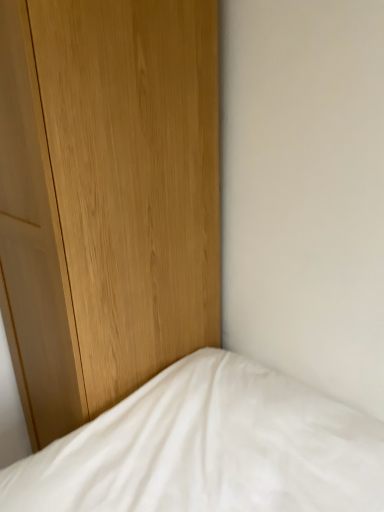
You are a GUI agent. You are given a task and a screenshot of the screen. Output one action in this format:
    pyautogui.click(x=<x>, y=<y>)
    Task: Click on the white matte bed at lower right
    
    Given the screenshot: What is the action you would take?
    pyautogui.click(x=209, y=448)

Consider the image. Measure the distance between point (268, 505) and camera.

A distance of 38.58 inches exists between point (268, 505) and camera.

The image size is (384, 512). Describe the element at coordinates (209, 448) in the screenshot. I see `white matte bed at lower right` at that location.

Where is `white matte bed at lower right`? This screenshot has height=512, width=384. white matte bed at lower right is located at coordinates (209, 448).